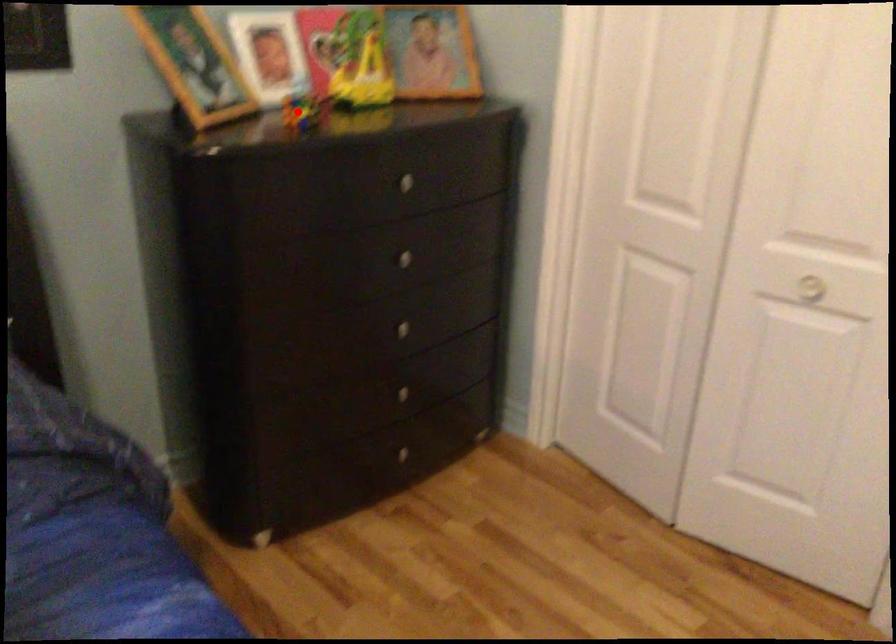
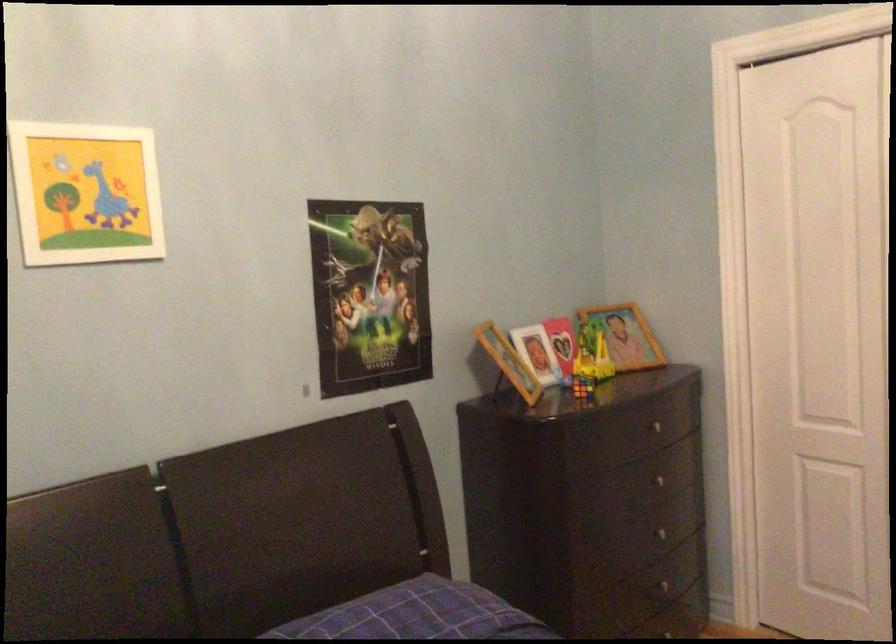
Question: I am providing you with two images of the same scene from different viewpoints. Given a red point in image1, look at the same physical point in image2. Is it:

Choices:
 (A) Closer to the viewpoint
 (B) Farther from the viewpoint

Answer: (B)